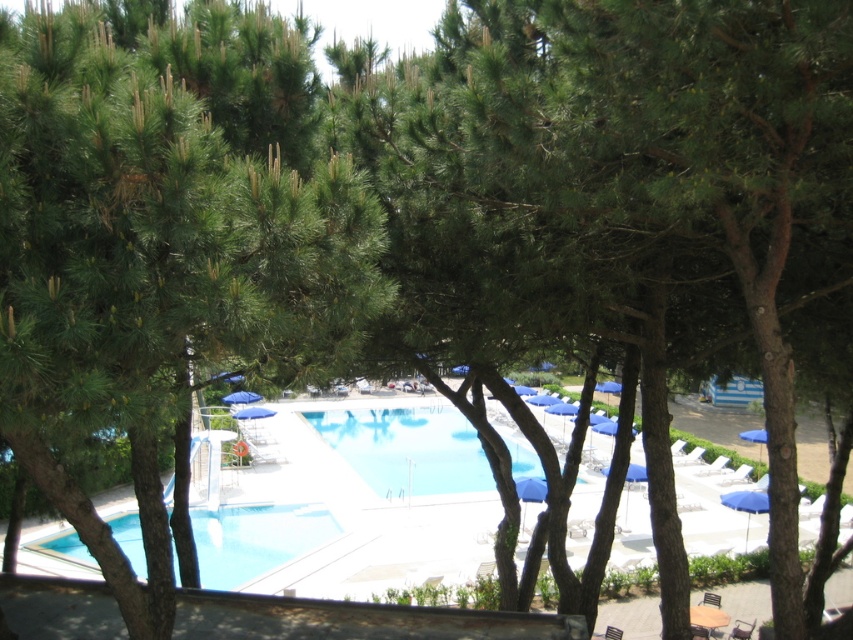
Question: Is blue smooth water at center bigger than blue fabric umbrella at lower right?

Choices:
 (A) no
 (B) yes

Answer: (B)

Question: Which point is closer to the camera?

Choices:
 (A) (332, 518)
 (B) (225, 401)

Answer: (A)

Question: Can you confirm if clear blue water at center is positioned below blue fabric umbrella at center?

Choices:
 (A) yes
 (B) no

Answer: (A)

Question: Among these objects, which one is farthest from the camera?

Choices:
 (A) blue smooth water at center
 (B) green needle-like leaves at center
 (C) blue fabric umbrella at lower right

Answer: (C)

Question: Does clear blue water at center come behind blue fabric umbrella at center?

Choices:
 (A) yes
 (B) no

Answer: (B)

Question: Which object appears closest to the camera in this image?

Choices:
 (A) green needle-like leaves at center
 (B) blue fabric umbrella at lower right
 (C) clear blue water at center

Answer: (A)